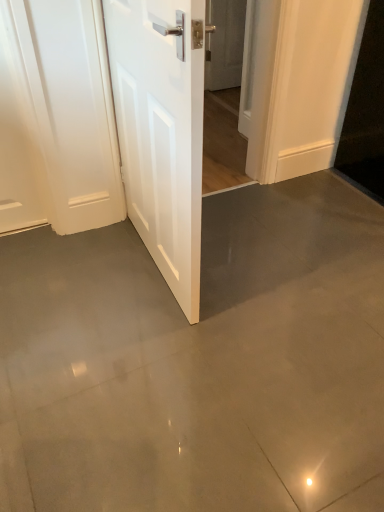
Question: Which direction should I rotate to face white glossy door at center, which is counted as the first door, starting from the left, — up or down?

Choices:
 (A) down
 (B) up

Answer: (B)

Question: Does white glossy door at upper center, which is the 2th door from bottom to top, have a greater height compared to white glossy door at center, which is the 1th door in front-to-back order?

Choices:
 (A) no
 (B) yes

Answer: (A)

Question: Is white glossy door at upper center, marked as the second door in a left-to-right arrangement, positioned with its back to white glossy door at center, which is the 1th door in front-to-back order?

Choices:
 (A) no
 (B) yes

Answer: (A)

Question: Is white glossy door at upper center, which is the 1th door from back to front, in contact with white glossy door at center, which is the 2th door in back-to-front order?

Choices:
 (A) yes
 (B) no

Answer: (B)

Question: Is white glossy door at upper center, the 2th door in the front-to-back sequence, closer to the viewer compared to white glossy door at center, which is the 1th door in front-to-back order?

Choices:
 (A) no
 (B) yes

Answer: (A)

Question: Is white glossy door at upper center, the 2th door in the front-to-back sequence, oriented towards white glossy door at center, positioned as the second door in top-to-bottom order?

Choices:
 (A) no
 (B) yes

Answer: (A)

Question: Is white glossy door at upper center, which is the first door from right to left, positioned far away from white glossy door at center, positioned as the second door in top-to-bottom order?

Choices:
 (A) no
 (B) yes

Answer: (B)

Question: Is white glossy door at center, positioned as the second door in top-to-bottom order, in front of white glossy door at upper center, marked as the second door in a left-to-right arrangement?

Choices:
 (A) yes
 (B) no

Answer: (A)

Question: From a real-world perspective, is white glossy door at center, which appears as the 2th door when viewed from the right, positioned over white glossy door at upper center, which is the 2th door from bottom to top, based on gravity?

Choices:
 (A) no
 (B) yes

Answer: (B)

Question: Can we say white glossy door at center, which appears as the 2th door when viewed from the right, lies outside white glossy door at upper center, which appears as the first door when viewed from the top?

Choices:
 (A) no
 (B) yes

Answer: (B)

Question: Does white glossy door at center, positioned as the second door in top-to-bottom order, appear on the right side of white glossy door at upper center, the 2th door in the front-to-back sequence?

Choices:
 (A) yes
 (B) no

Answer: (B)

Question: Can you confirm if white glossy door at center, which is the 2th door in back-to-front order, is thinner than white glossy door at upper center, which is the first door from right to left?

Choices:
 (A) no
 (B) yes

Answer: (A)

Question: Is white glossy door at center, which is the 1th door in front-to-back order, oriented towards white glossy door at upper center, marked as the second door in a left-to-right arrangement?

Choices:
 (A) no
 (B) yes

Answer: (A)

Question: Considering their positions, is white glossy door at center, which appears as the 2th door when viewed from the right, located in front of or behind white glossy door at upper center, the 2th door in the front-to-back sequence?

Choices:
 (A) front
 (B) behind

Answer: (A)